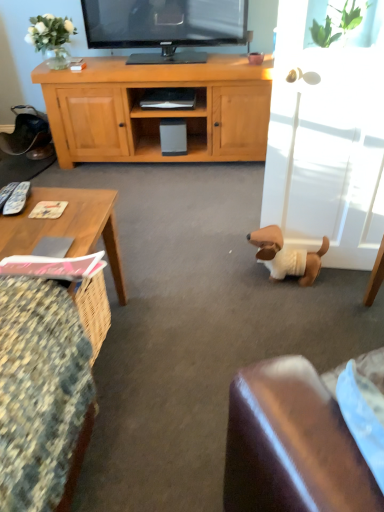
Question: Is matte black shelf at center inside wooden textured coffee table at lower left?

Choices:
 (A) no
 (B) yes

Answer: (A)

Question: Is the position of wooden textured coffee table at lower left more distant than that of matte black shelf at center?

Choices:
 (A) yes
 (B) no

Answer: (B)

Question: Is wooden textured coffee table at lower left far from matte black shelf at center?

Choices:
 (A) no
 (B) yes

Answer: (B)

Question: From a real-world perspective, is wooden textured coffee table at lower left on matte black shelf at center?

Choices:
 (A) no
 (B) yes

Answer: (B)

Question: Considering the relative sizes of wooden textured coffee table at lower left and matte black shelf at center in the image provided, is wooden textured coffee table at lower left wider than matte black shelf at center?

Choices:
 (A) no
 (B) yes

Answer: (A)

Question: In terms of height, does matte black shelf at center look taller or shorter compared to white glossy glass door at right?

Choices:
 (A) tall
 (B) short

Answer: (B)

Question: From the image's perspective, is matte black shelf at center positioned above or below white glossy glass door at right?

Choices:
 (A) above
 (B) below

Answer: (A)

Question: Is matte black shelf at center wider or thinner than white glossy glass door at right?

Choices:
 (A) wide
 (B) thin

Answer: (B)

Question: Does point (155, 113) appear closer or farther from the camera than point (301, 144)?

Choices:
 (A) closer
 (B) farther

Answer: (B)

Question: Do you think wooden textured coffee table at lower left is within floral fabric cushion at lower left, or outside of it?

Choices:
 (A) outside
 (B) inside

Answer: (A)

Question: From their relative heights in the image, would you say wooden textured coffee table at lower left is taller or shorter than floral fabric cushion at lower left?

Choices:
 (A) short
 (B) tall

Answer: (A)

Question: Based on their sizes in the image, would you say wooden textured coffee table at lower left is bigger or smaller than floral fabric cushion at lower left?

Choices:
 (A) small
 (B) big

Answer: (A)

Question: Visually, is wooden textured coffee table at lower left positioned to the left or to the right of floral fabric cushion at lower left?

Choices:
 (A) right
 (B) left

Answer: (A)

Question: Is floral fabric cushion at lower left taller or shorter than white glossy glass door at right?

Choices:
 (A) tall
 (B) short

Answer: (B)

Question: In the image, is floral fabric cushion at lower left positioned in front of or behind white glossy glass door at right?

Choices:
 (A) behind
 (B) front

Answer: (B)